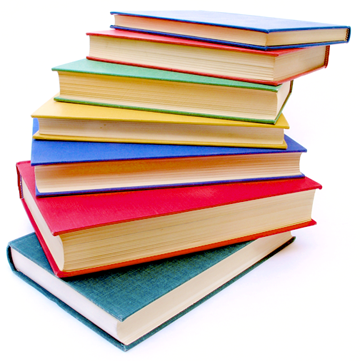
Locate an element on the screen. books is located at coordinates (273, 35), (264, 60), (239, 98), (222, 130), (197, 167), (164, 234), (138, 318).